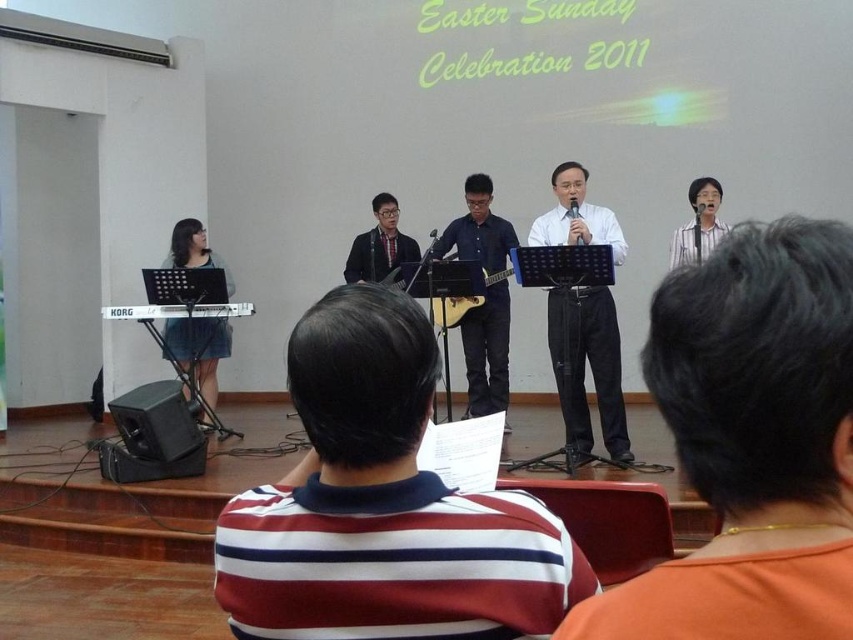
Question: Which of the following is the closest to the observer?

Choices:
 (A) (566, 324)
 (B) (469, 356)

Answer: (A)

Question: Can you confirm if orange fabric at upper right is thinner than white smooth shirt at center?

Choices:
 (A) no
 (B) yes

Answer: (B)

Question: Which of the following is the farthest from the observer?

Choices:
 (A) (732, 580)
 (B) (582, 212)

Answer: (B)

Question: Where is orange fabric at upper right located in relation to blue matte guitar at center in the image?

Choices:
 (A) right
 (B) left

Answer: (B)

Question: Is white smooth shirt at center to the left of blue matte guitar at center from the viewer's perspective?

Choices:
 (A) yes
 (B) no

Answer: (B)

Question: Which point is farther to the camera?

Choices:
 (A) blue matte guitar at center
 (B) orange fabric at upper right
 (C) white smooth shirt at center

Answer: (A)